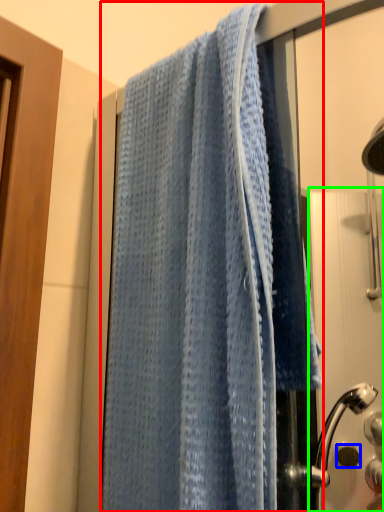
Question: Based on their relative distances, which object is nearer to towel (highlighted by a red box)? Choose from knob (highlighted by a blue box) and screen door (highlighted by a green box).

Choices:
 (A) knob
 (B) screen door

Answer: (B)